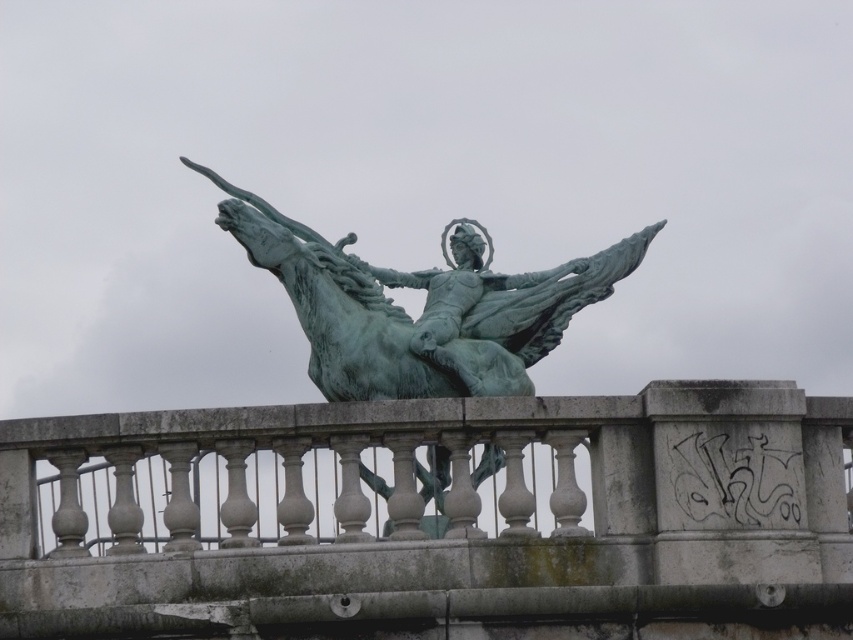
You are an architect reviewing a historical site. You observe the green stone railing at center and the green patina statue at center. Which object has a greater height?

The green patina statue at center is taller than the green stone railing at center, so the statue has a greater height.

You are an architect designing a new plaza and want to place the green stone railing at center and the green patina statue at center next to each other. Based on the scene, which object is wider?

The green stone railing at center is wider than the green patina statue at center because the description states that the green stone railing at center surpasses the statue in width.

You are standing in front of the scene described. Where is the green stone railing at center located in terms of its 2D coordinates?

The green stone railing at center is located at the 2D coordinates of point (436, 518).